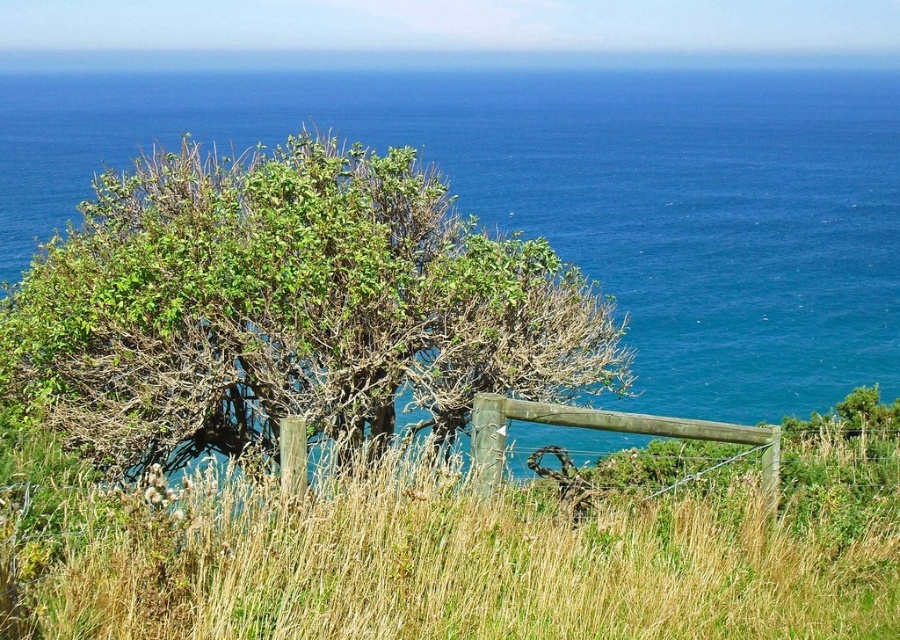
Question: Is green grass at center bigger than green leafy bush at left?

Choices:
 (A) no
 (B) yes

Answer: (B)

Question: Among these objects, which one is farthest from the camera?

Choices:
 (A) green leafy bush at left
 (B) green grass at center

Answer: (A)

Question: Among these points, which one is nearest to the camera?

Choices:
 (A) (230, 198)
 (B) (383, 625)

Answer: (B)

Question: Is green grass at center behind green leafy bush at left?

Choices:
 (A) yes
 (B) no

Answer: (B)

Question: Is green grass at center bigger than green leafy bush at left?

Choices:
 (A) no
 (B) yes

Answer: (B)